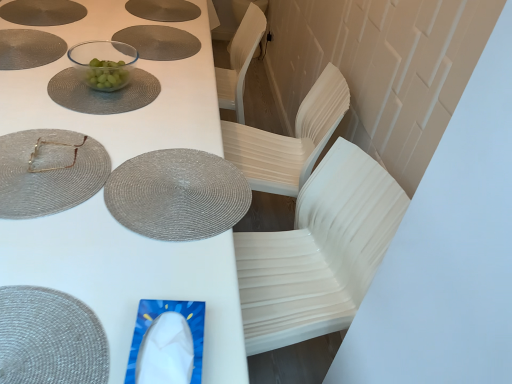
The height and width of the screenshot is (384, 512). I want to click on free space between matte woven placemat at upper left, marked as the 1th glass plate in a front-to-back arrangement, and silver textured placemat at center, which is the second tableware from front to back, so click(x=108, y=170).